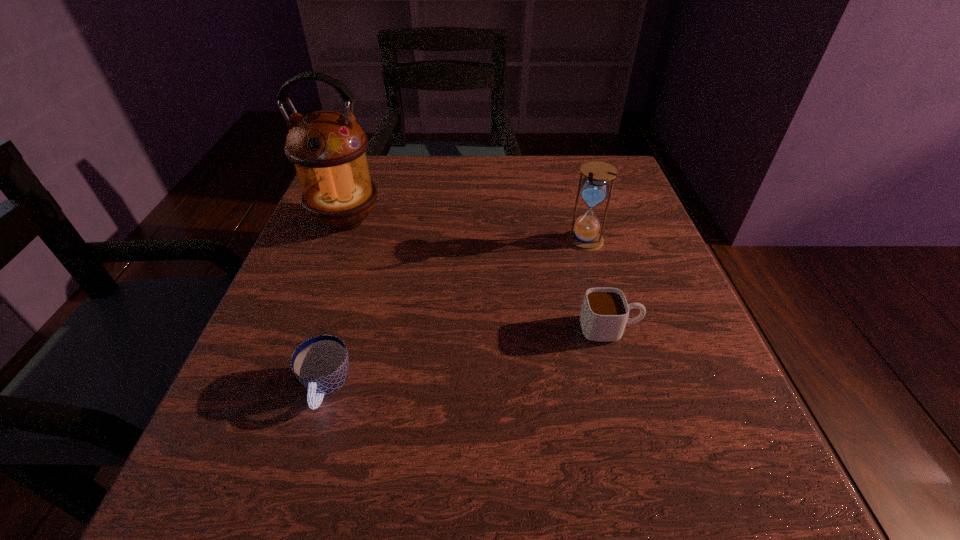
This screenshot has height=540, width=960. Find the location of `vacant area that lies between the hourglass and the left cup`. vacant area that lies between the hourglass and the left cup is located at coordinates (456, 315).

Select which object is the second closest to the oil lamp. Please provide its 2D coordinates. Your answer should be formatted as a tuple, i.e. [(x, y)], where the tuple contains the x and y coordinates of a point satisfying the conditions above.

[(585, 236)]

Locate which object is the third closest to the nearest object. Please provide its 2D coordinates. Your answer should be formatted as a tuple, i.e. [(x, y)], where the tuple contains the x and y coordinates of a point satisfying the conditions above.

[(585, 236)]

Where is `vacant space that satisfies the following two spatial constraints: 1. on the front side of the second tallest object; 2. on the right side of the tallest object`? This screenshot has height=540, width=960. vacant space that satisfies the following two spatial constraints: 1. on the front side of the second tallest object; 2. on the right side of the tallest object is located at coordinates (338, 241).

Find the location of `free space that satisfies the following two spatial constraints: 1. on the front side of the third shortest object; 2. on the right side of the oil lamp`. free space that satisfies the following two spatial constraints: 1. on the front side of the third shortest object; 2. on the right side of the oil lamp is located at coordinates (338, 241).

I want to click on free space that satisfies the following two spatial constraints: 1. on the side with the handle of the farther cup; 2. on the side of the nearer cup with the handle, so click(x=626, y=388).

Find the location of `vacant space that satisfies the following two spatial constraints: 1. on the side with the handle of the farther cup; 2. on the side of the nearest object with the handle`. vacant space that satisfies the following two spatial constraints: 1. on the side with the handle of the farther cup; 2. on the side of the nearest object with the handle is located at coordinates (626, 388).